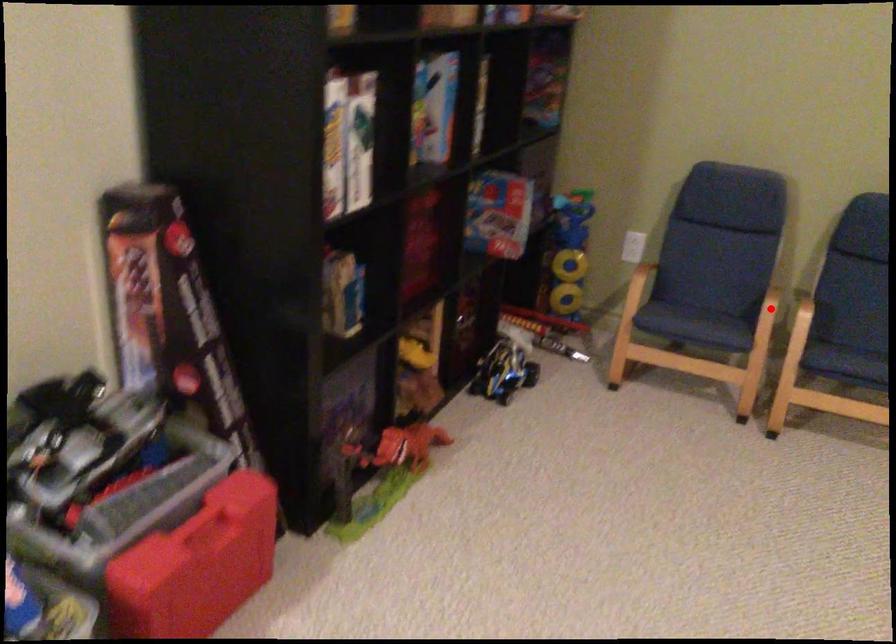
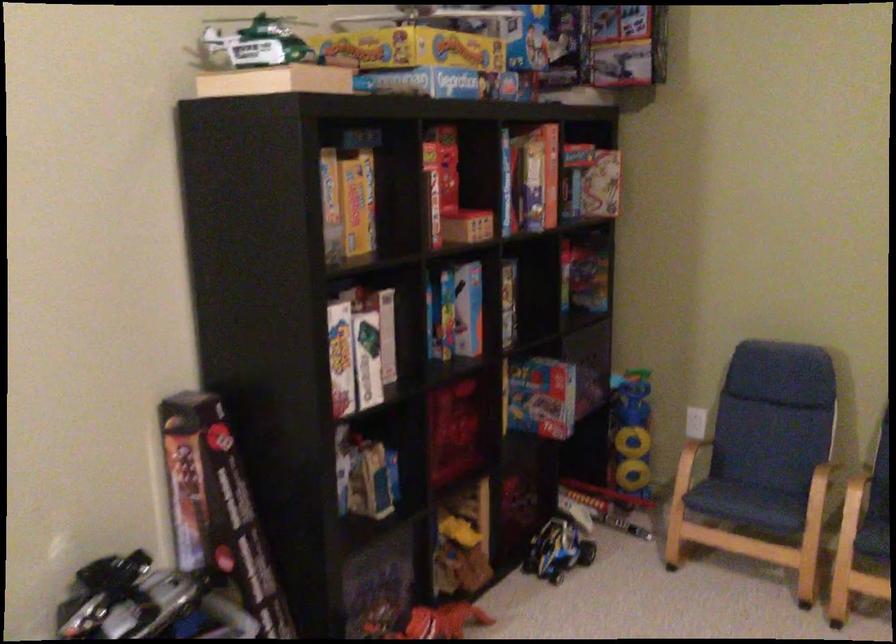
Where in the second image is the point corresponding to the highlighted location from the first image?

(823, 489)